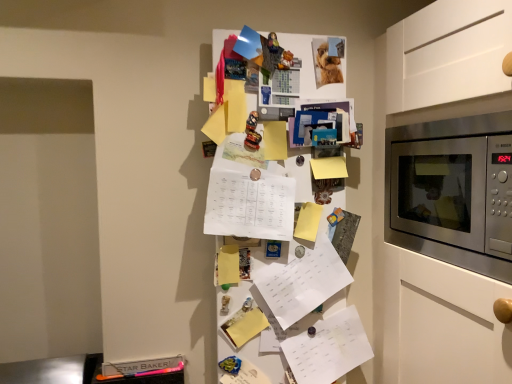
Question: Does white paper at center, the third list positioned from the bottom, have a greater width compared to white paper at center, which is counted as the first list, starting from the bottom?

Choices:
 (A) no
 (B) yes

Answer: (B)

Question: From a real-world perspective, is white paper at center, the third list positioned from the bottom, over white paper at center, acting as the 3th list starting from the top?

Choices:
 (A) no
 (B) yes

Answer: (B)

Question: Does white paper at center, acting as the 1th list starting from the top, have a greater height compared to white paper at center, which is counted as the first list, starting from the bottom?

Choices:
 (A) yes
 (B) no

Answer: (B)

Question: Is white paper at center, acting as the 1th list starting from the top, outside white paper at center, which is counted as the first list, starting from the bottom?

Choices:
 (A) yes
 (B) no

Answer: (A)

Question: From the image's perspective, is white paper at center, the third list positioned from the bottom, over white paper at center, acting as the 3th list starting from the top?

Choices:
 (A) yes
 (B) no

Answer: (A)

Question: Is white paper at center, the 2th list positioned from the top, to the left or to the right of white paper at center, acting as the 1th list starting from the top, in the image?

Choices:
 (A) left
 (B) right

Answer: (B)

Question: From a real-world perspective, is white paper at center, arranged as the 2th list when ordered from the bottom, above or below white paper at center, acting as the 1th list starting from the top?

Choices:
 (A) below
 (B) above

Answer: (A)

Question: Is white paper at center, the 2th list positioned from the top, in front of or behind white paper at center, the third list positioned from the bottom, in the image?

Choices:
 (A) front
 (B) behind

Answer: (B)

Question: Considering the positions of point (311, 309) and point (236, 228), is point (311, 309) closer or farther from the camera than point (236, 228)?

Choices:
 (A) closer
 (B) farther

Answer: (B)

Question: From the image's perspective, is stainless steel microwave at right located above or below white paper at center, the 2th list positioned from the top?

Choices:
 (A) above
 (B) below

Answer: (A)

Question: Looking at their shapes, would you say stainless steel microwave at right is wider or thinner than white paper at center, the 2th list positioned from the top?

Choices:
 (A) thin
 (B) wide

Answer: (B)

Question: Is point (462, 140) closer or farther from the camera than point (310, 279)?

Choices:
 (A) farther
 (B) closer

Answer: (B)

Question: Relative to white paper at center, the 2th list positioned from the top, is stainless steel microwave at right in front or behind?

Choices:
 (A) behind
 (B) front

Answer: (B)

Question: Is white paper at center, acting as the 3th list starting from the top, wider or thinner than white paper at center, arranged as the 2th list when ordered from the bottom?

Choices:
 (A) thin
 (B) wide

Answer: (B)

Question: Considering the relative positions of white paper at center, acting as the 3th list starting from the top, and white paper at center, arranged as the 2th list when ordered from the bottom, in the image provided, is white paper at center, acting as the 3th list starting from the top, to the left or to the right of white paper at center, arranged as the 2th list when ordered from the bottom,?

Choices:
 (A) right
 (B) left

Answer: (A)